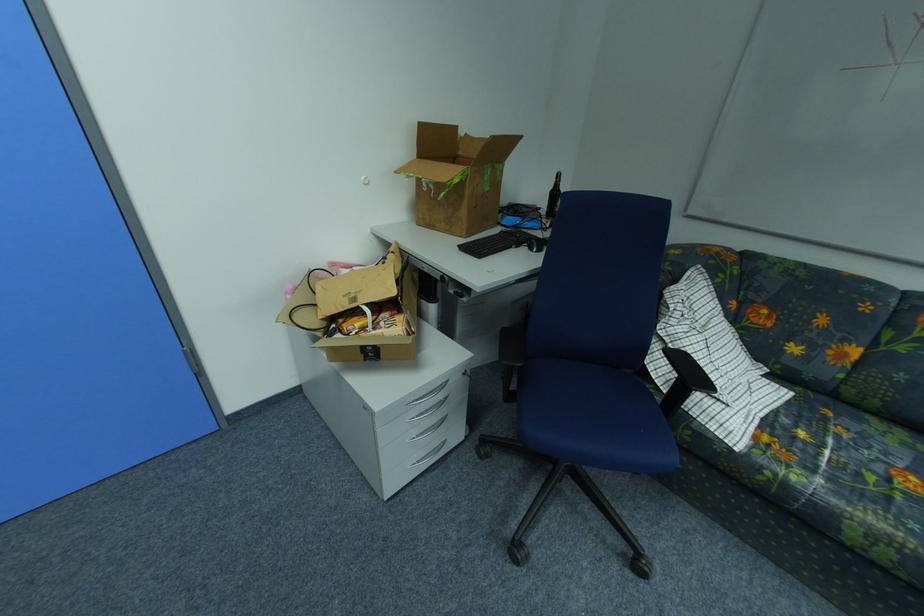
Identify the location of black computer mouse. The width and height of the screenshot is (924, 616). (535, 243).